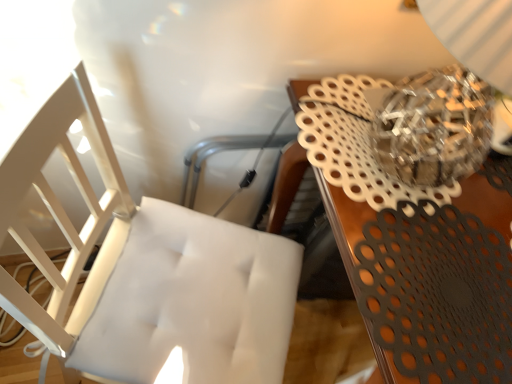
Question: Does point (365, 243) appear closer or farther from the camera than point (121, 188)?

Choices:
 (A) farther
 (B) closer

Answer: (B)

Question: Is metallic brown table at upper right wider or thinner than white tufted cushion at left?

Choices:
 (A) wide
 (B) thin

Answer: (A)

Question: In terms of size, does metallic brown table at upper right appear bigger or smaller than white tufted cushion at left?

Choices:
 (A) small
 (B) big

Answer: (B)

Question: Is white tufted cushion at left taller or shorter than metallic brown table at upper right?

Choices:
 (A) short
 (B) tall

Answer: (B)

Question: Considering the relative positions of white tufted cushion at left and metallic brown table at upper right in the image provided, is white tufted cushion at left to the left or to the right of metallic brown table at upper right?

Choices:
 (A) left
 (B) right

Answer: (A)

Question: Which is correct: white tufted cushion at left is inside metallic brown table at upper right, or outside of it?

Choices:
 (A) outside
 (B) inside

Answer: (A)

Question: Considering the positions of white tufted cushion at left and metallic brown table at upper right in the image, is white tufted cushion at left bigger or smaller than metallic brown table at upper right?

Choices:
 (A) small
 (B) big

Answer: (A)